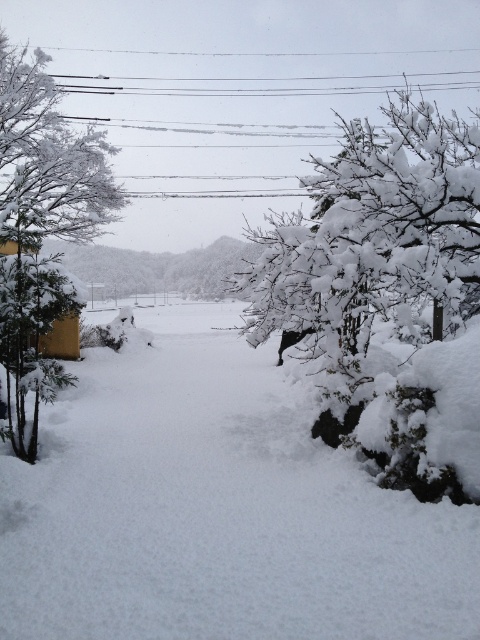
Question: Which of these objects is positioned closest to the white fluffy snow at center?

Choices:
 (A) white frosty tree at right
 (B) white frosty tree at left

Answer: (B)

Question: Which object is the farthest from the white fluffy snow at center?

Choices:
 (A) white frosty tree at left
 (B) white frosty tree at right

Answer: (B)

Question: Does white fluffy snow at center have a greater width compared to white frosty tree at left?

Choices:
 (A) no
 (B) yes

Answer: (A)

Question: Can you confirm if white fluffy snow at center is smaller than white frosty tree at right?

Choices:
 (A) yes
 (B) no

Answer: (A)

Question: Among these objects, which one is farthest from the camera?

Choices:
 (A) white frosty tree at left
 (B) white fluffy snow at center
 (C) white frosty tree at right

Answer: (A)

Question: Does white fluffy snow at center lie behind white frosty tree at right?

Choices:
 (A) yes
 (B) no

Answer: (B)